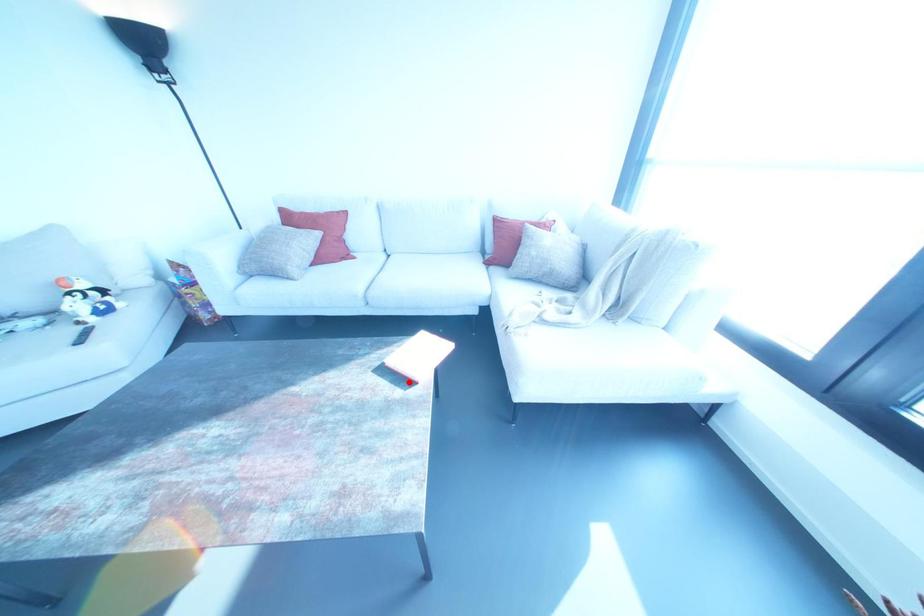
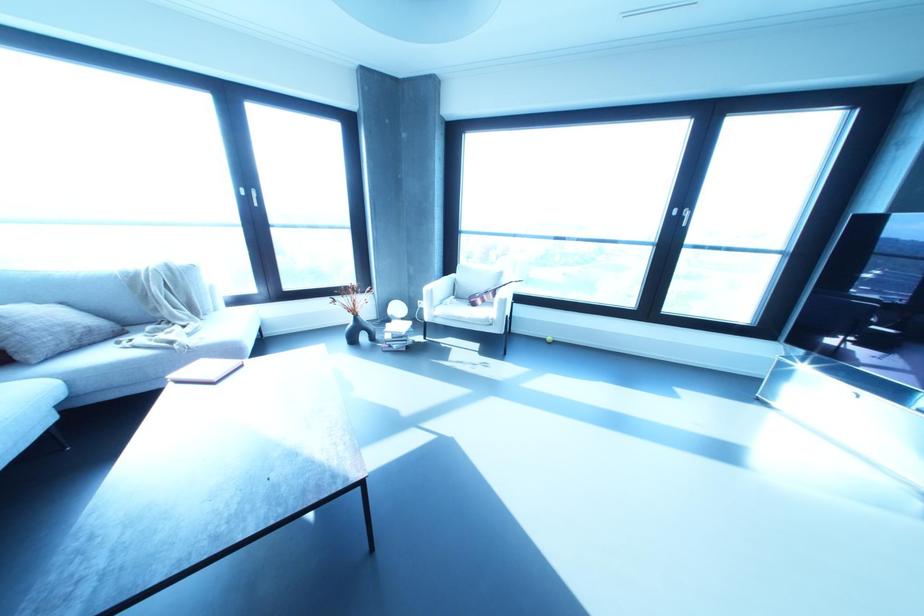
Find the pixel in the second image that matches the highlighted location in the first image.

(241, 365)